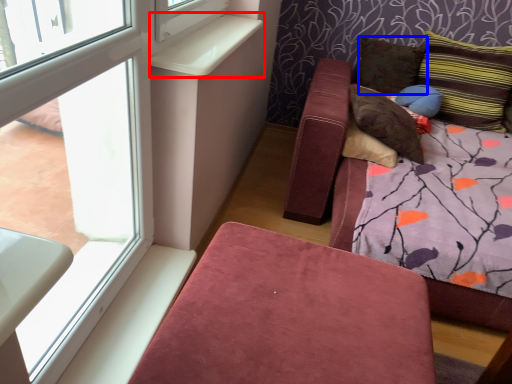
Question: Among these objects, which one is farthest to the camera, window sill (highlighted by a red box) or pillow (highlighted by a blue box)?

Choices:
 (A) window sill
 (B) pillow

Answer: (B)